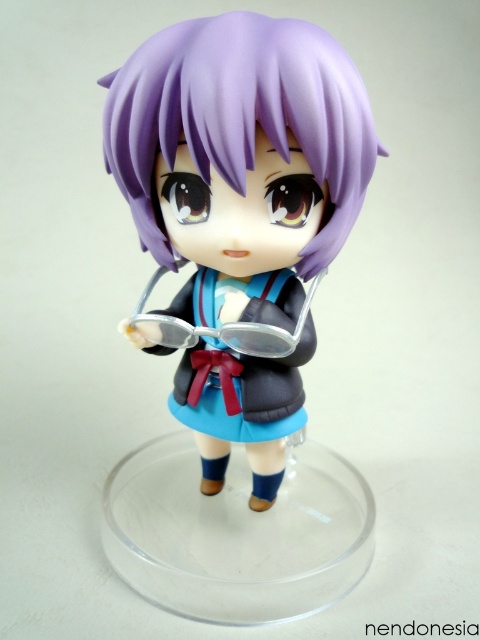
Question: Which of the following is the farthest from the observer?

Choices:
 (A) (295, 113)
 (B) (267, 371)

Answer: (B)

Question: Among these objects, which one is farthest from the camera?

Choices:
 (A) matte purple hair at center
 (B) matte plastic school uniform at center

Answer: (B)

Question: Is matte purple hair at center to the right of matte plastic school uniform at center from the viewer's perspective?

Choices:
 (A) no
 (B) yes

Answer: (B)

Question: Among these points, which one is farthest from the camera?

Choices:
 (A) (157, 352)
 (B) (204, 90)

Answer: (A)

Question: Is matte purple hair at center to the left of matte plastic school uniform at center from the viewer's perspective?

Choices:
 (A) yes
 (B) no

Answer: (B)

Question: Does matte purple hair at center lie behind matte plastic school uniform at center?

Choices:
 (A) yes
 (B) no

Answer: (B)